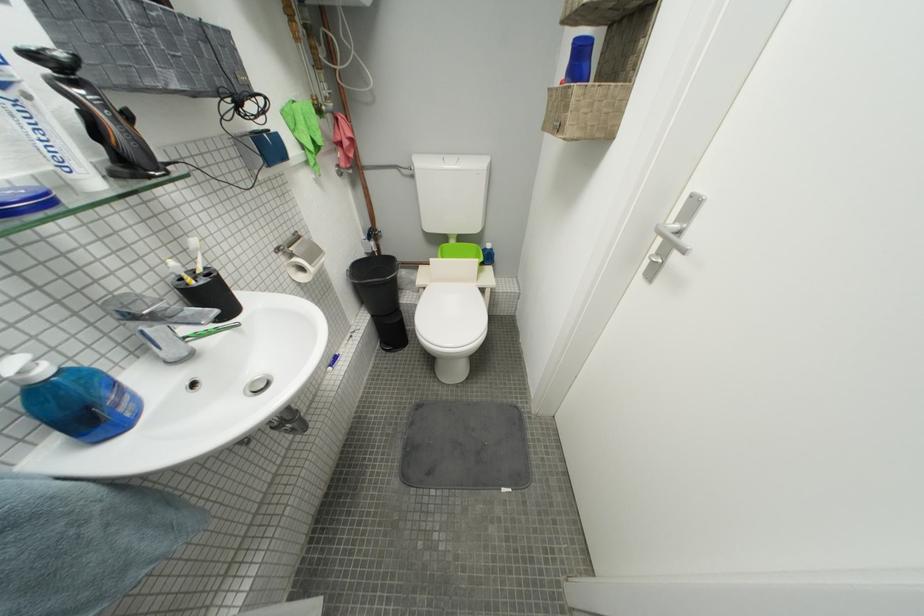
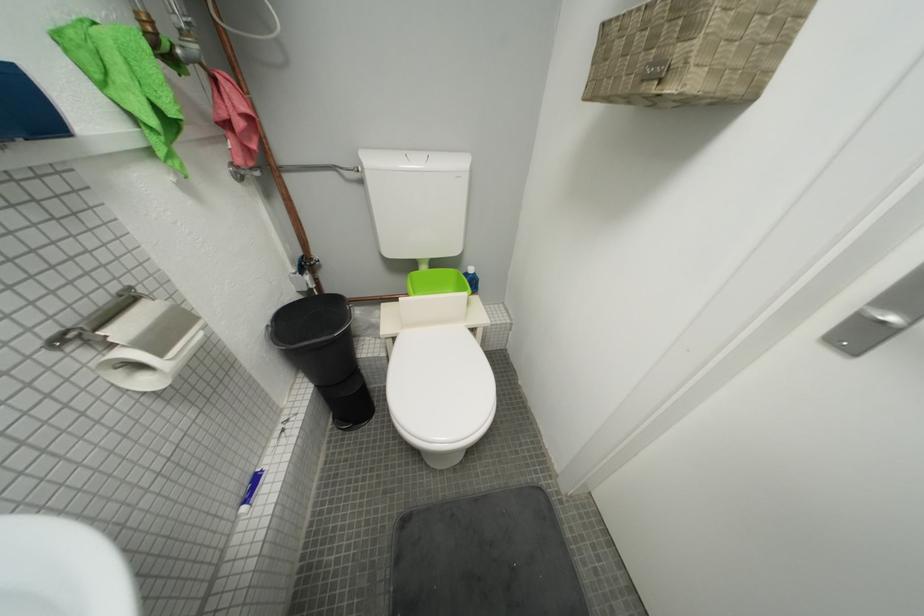
Question: How did the camera likely rotate?

Choices:
 (A) Left
 (B) Right
 (C) Up
 (D) Down

Answer: (B)